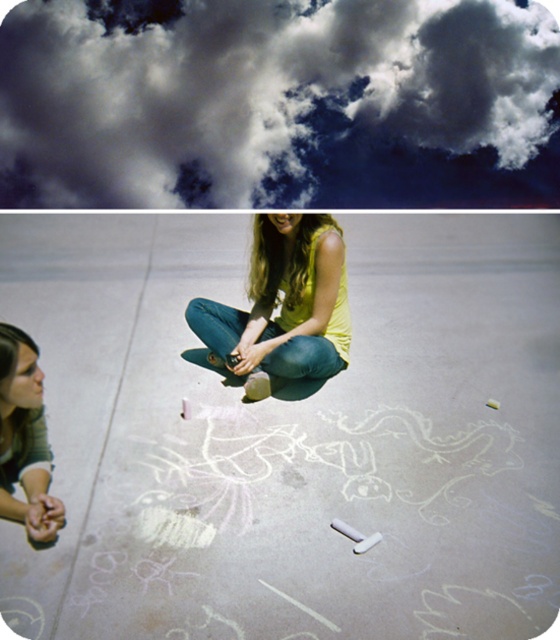
You are standing in the middle of the concrete area and looking up at the cloudy sky at upper center and the matte yellow shirt at center. Which object is located to your right?

The cloudy sky at upper center is positioned on the right side of the matte yellow shirt at center, so when looking up from the center, the cloudy sky at upper center would be to your right.